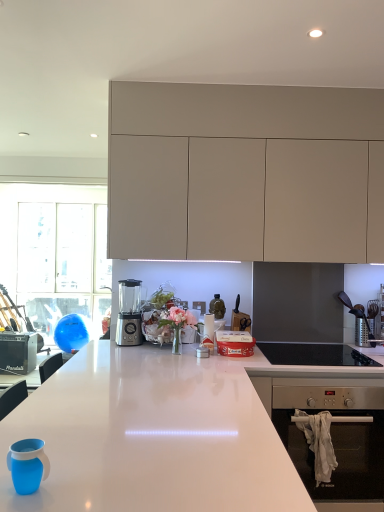
Where is `free spot behind teal silicone cup at lower left`? The height and width of the screenshot is (512, 384). free spot behind teal silicone cup at lower left is located at coordinates (62, 449).